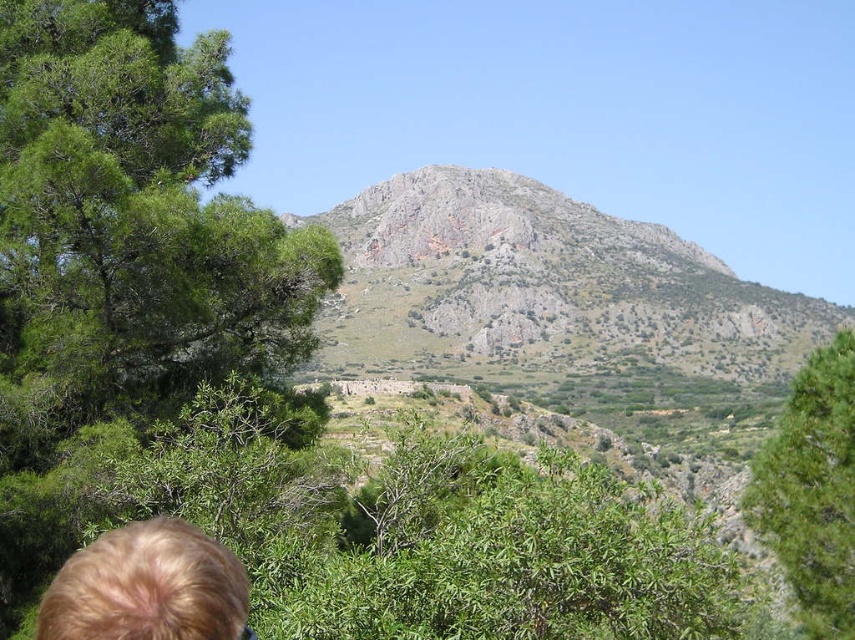
Is point (143, 164) more distant than point (797, 403)?

No, it is in front of (797, 403).

Does point (278, 292) come closer to viewer compared to point (830, 472)?

No, (278, 292) is behind (830, 472).

You are a GUI agent. You are given a task and a screenshot of the screen. Output one action in this format:
    pyautogui.click(x=<x>, y=<y>)
    Task: Click on the green leafy tree at left
    Image resolution: width=855 pixels, height=640 pixels.
    Given the screenshot: What is the action you would take?
    pyautogui.click(x=137, y=211)

Locate an element on the screen. This screenshot has width=855, height=640. green leafy tree at center-right is located at coordinates (812, 490).

Does point (775, 522) come behind point (151, 573)?

Yes.

Where is `green leafy tree at center-right`? The height and width of the screenshot is (640, 855). green leafy tree at center-right is located at coordinates (812, 490).

From the picture: Does green leafy tree at left have a lesser width compared to blonde hair at lower left?

Incorrect, green leafy tree at left's width is not less than blonde hair at lower left's.

The width and height of the screenshot is (855, 640). I want to click on green leafy tree at left, so click(x=137, y=211).